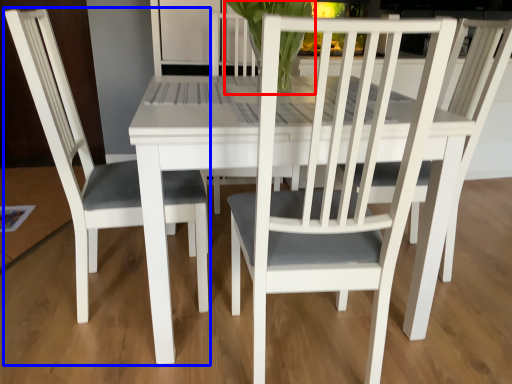
Question: Among these objects, which one is farthest to the camera, orchid (highlighted by a red box) or chair (highlighted by a blue box)?

Choices:
 (A) orchid
 (B) chair

Answer: (A)